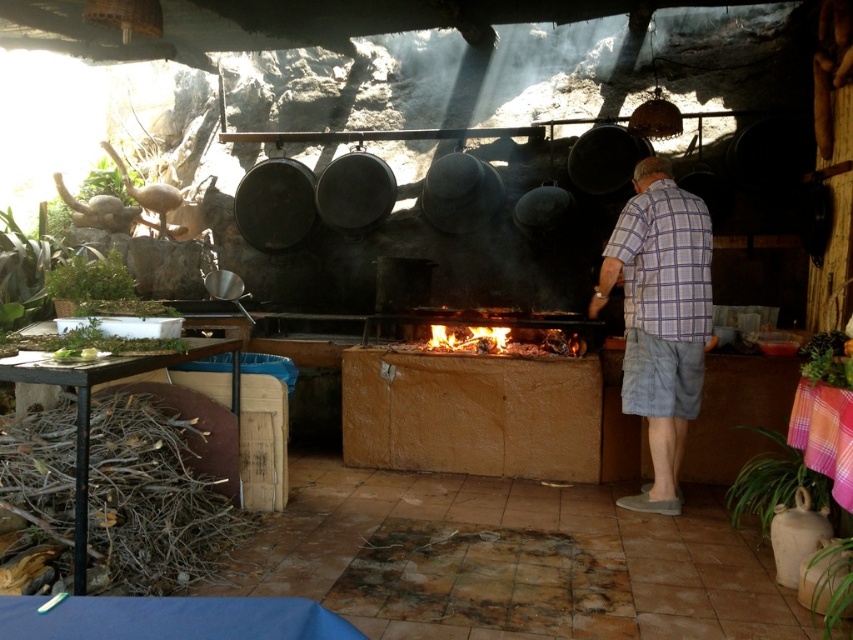
Is plaid shirt at center positioned at the back of burning wood at center?

No, it is in front of burning wood at center.

Who is higher up, plaid shirt at center or burning wood at center?

burning wood at center is above.

Locate an element on the screen. Image resolution: width=853 pixels, height=640 pixels. plaid shirt at center is located at coordinates (660, 317).

Image resolution: width=853 pixels, height=640 pixels. What are the coordinates of `plaid shirt at center` in the screenshot? It's located at (660, 317).